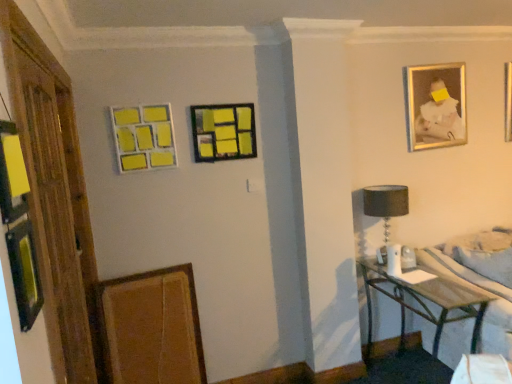
Question: From a real-world perspective, does gold-framed photo at upper right, which appears as the 1th picture frame when viewed from the top, sit lower than black fabric lampshade at right?

Choices:
 (A) no
 (B) yes

Answer: (A)

Question: Is the position of gold-framed photo at upper right, the fourth picture frame in the bottom-to-top sequence, more distant than that of black fabric lampshade at right?

Choices:
 (A) no
 (B) yes

Answer: (B)

Question: From the image's perspective, does gold-framed photo at upper right, the 4th picture frame from the left, appear lower than black fabric lampshade at right?

Choices:
 (A) no
 (B) yes

Answer: (A)

Question: Considering the relative positions of gold-framed photo at upper right, which appears as the 1th picture frame when viewed from the top, and black fabric lampshade at right in the image provided, is gold-framed photo at upper right, which appears as the 1th picture frame when viewed from the top, to the right of black fabric lampshade at right from the viewer's perspective?

Choices:
 (A) no
 (B) yes

Answer: (B)

Question: Is gold-framed photo at upper right, the fourth picture frame in the bottom-to-top sequence, not inside black fabric lampshade at right?

Choices:
 (A) no
 (B) yes

Answer: (B)

Question: Is matte black picture frame at center, arranged as the 2th picture frame when viewed from the right, positioned with its back to wooden bed frame at lower right?

Choices:
 (A) no
 (B) yes

Answer: (A)

Question: From the image's perspective, does matte black picture frame at center, the 3th picture frame ordered from the bottom, appear lower than wooden bed frame at lower right?

Choices:
 (A) no
 (B) yes

Answer: (A)

Question: Is matte black picture frame at center, which ranks as the 2th picture frame in top-to-bottom order, at the left side of wooden bed frame at lower right?

Choices:
 (A) yes
 (B) no

Answer: (A)

Question: Considering the relative sizes of matte black picture frame at center, arranged as the 2th picture frame when viewed from the right, and wooden bed frame at lower right in the image provided, is matte black picture frame at center, arranged as the 2th picture frame when viewed from the right, bigger than wooden bed frame at lower right?

Choices:
 (A) yes
 (B) no

Answer: (B)

Question: Is matte black picture frame at center, arranged as the 2th picture frame when viewed from the right, outside of wooden bed frame at lower right?

Choices:
 (A) yes
 (B) no

Answer: (A)

Question: From a real-world perspective, is matte black picture frame at center, arranged as the 2th picture frame when viewed from the right, positioned under wooden bed frame at lower right based on gravity?

Choices:
 (A) yes
 (B) no

Answer: (B)

Question: Is metallic silver table at lower right smaller than gold-framed photo at upper right, positioned as the 1th picture frame in right-to-left order?

Choices:
 (A) yes
 (B) no

Answer: (B)